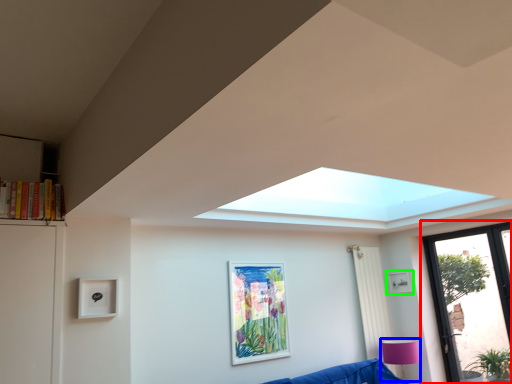
Question: Which object is the closest to the window (highlighted by a red box)? Choose among these: lamp (highlighted by a blue box) or picture frame (highlighted by a green box).

Choices:
 (A) lamp
 (B) picture frame

Answer: (B)